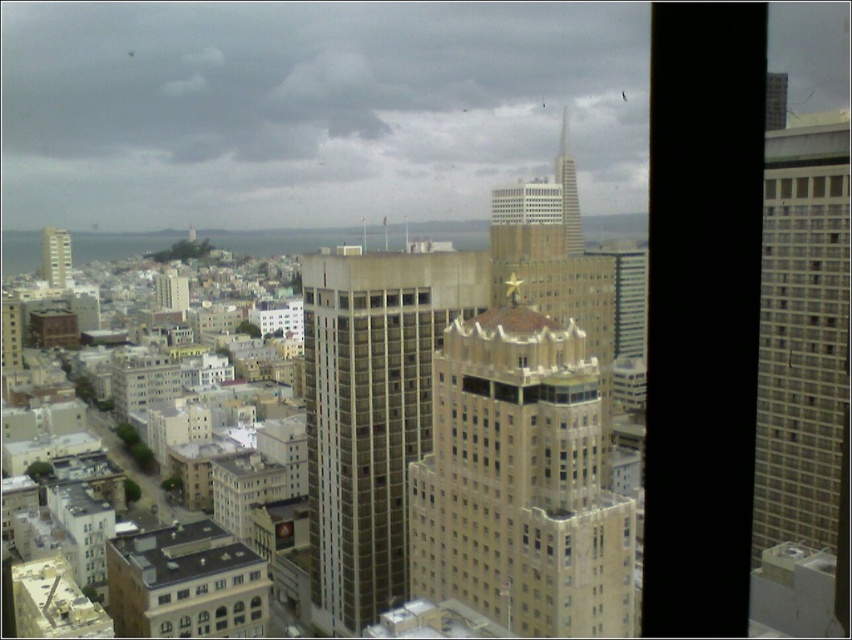
Is point (332, 616) closer to camera compared to point (556, 161)?

Yes, point (332, 616) is closer to viewer.

Which of these two, beige concrete building at center or beige stone skyscraper at upper center, stands shorter?

beige concrete building at center

Is point (343, 493) less distant than point (566, 150)?

That is True.

Locate an element on the screen. This screenshot has height=640, width=852. beige concrete building at center is located at coordinates (371, 412).

Between beige stone tower at center and beige concrete building at center, which one is positioned higher?

beige concrete building at center is above.

Is point (465, 492) positioned behind point (373, 572)?

No.

Locate an element on the screen. This screenshot has height=640, width=852. beige stone tower at center is located at coordinates (521, 481).

Between beige stone skyscraper at upper center and smooth glass skyscraper at upper right, which one appears on the left side from the viewer's perspective?

beige stone skyscraper at upper center

Is beige stone skyscraper at upper center to the left of smooth glass skyscraper at upper right from the viewer's perspective?

Indeed, beige stone skyscraper at upper center is positioned on the left side of smooth glass skyscraper at upper right.

Is point (579, 241) farther from viewer compared to point (786, 81)?

That is True.

At what (x,y) coordinates should I click in order to perform the action: click on beige stone skyscraper at upper center. Please return your answer as a coordinate pair (x, y). Image resolution: width=852 pixels, height=640 pixels. Looking at the image, I should click on (568, 193).